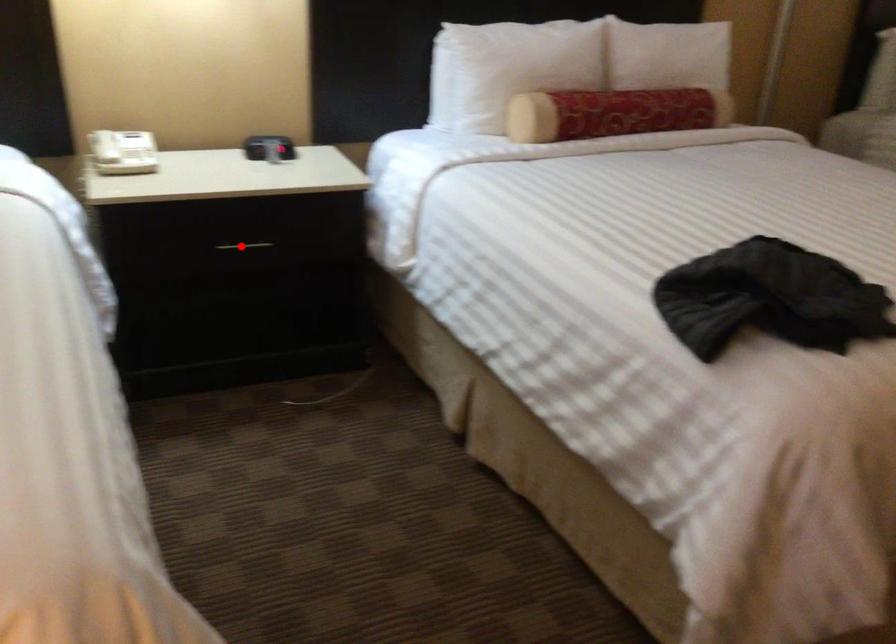
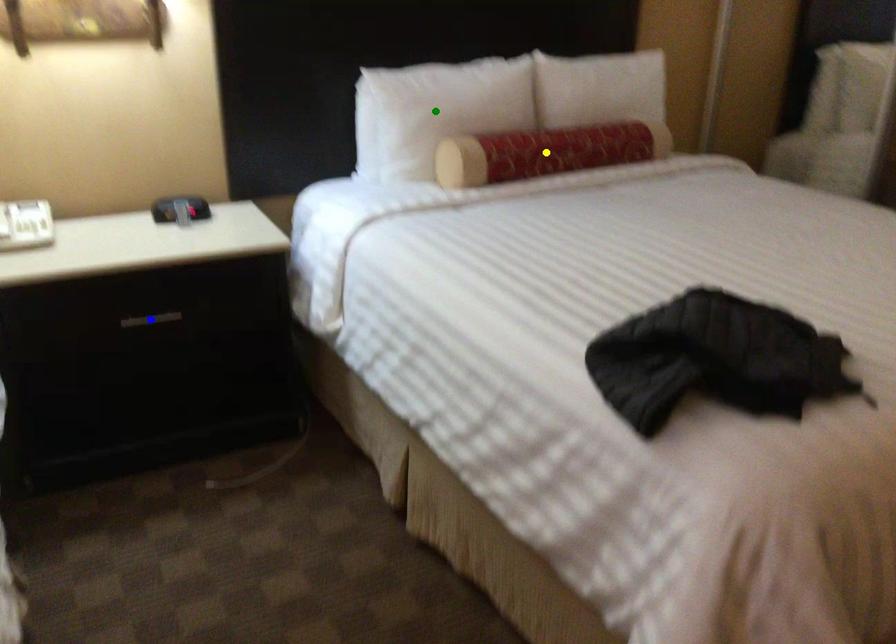
Question: I am providing you with two images of the same scene from different viewpoints. A red point is marked on the first image. You are given multiple points on the second image. Which mark in image 2 goes with the point in image 1?

Choices:
 (A) green point
 (B) blue point
 (C) yellow point

Answer: (B)